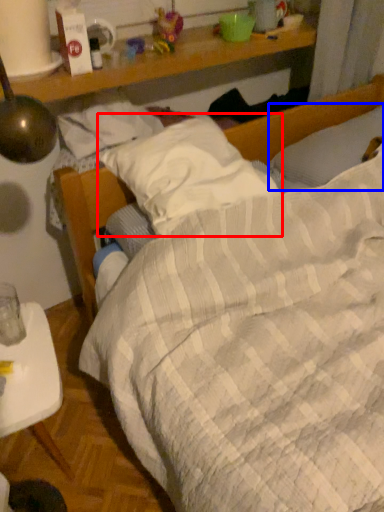
Question: Which of the following is the farthest to the observer, pillow (highlighted by a red box) or pillow (highlighted by a blue box)?

Choices:
 (A) pillow
 (B) pillow

Answer: (B)